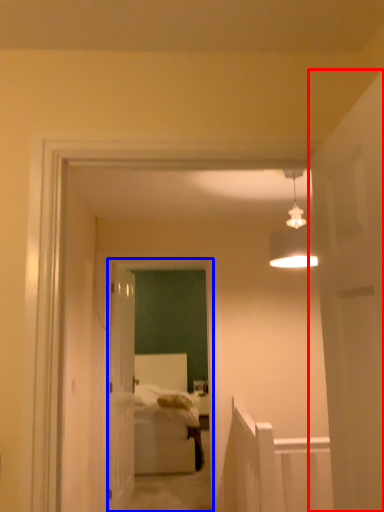
Question: Which of the following is the closest to the observer, door (highlighted by a red box) or glass door (highlighted by a blue box)?

Choices:
 (A) door
 (B) glass door

Answer: (A)